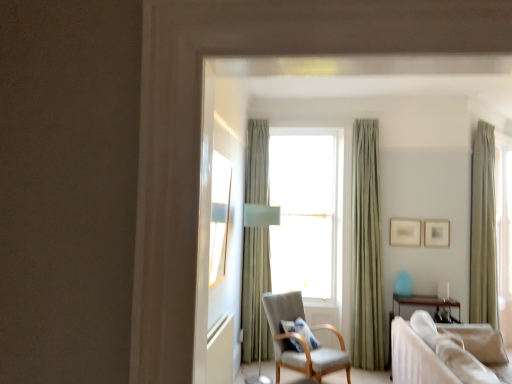
Question: Is sage green fabric curtain at center, the second curtain from the right, positioned far away from green velvet curtain at right, which is the 1th curtain in right-to-left order?

Choices:
 (A) no
 (B) yes

Answer: (B)

Question: From the image's perspective, does sage green fabric curtain at center, the second curtain from the right, appear higher than green velvet curtain at right, which is the 1th curtain in right-to-left order?

Choices:
 (A) no
 (B) yes

Answer: (A)

Question: Can you confirm if sage green fabric curtain at center, acting as the 2th curtain starting from the left, is positioned to the left of green velvet curtain at right, which is counted as the 3th curtain, starting from the left?

Choices:
 (A) yes
 (B) no

Answer: (A)

Question: Can you confirm if sage green fabric curtain at center, acting as the 2th curtain starting from the left, is taller than green velvet curtain at right, which is counted as the 3th curtain, starting from the left?

Choices:
 (A) no
 (B) yes

Answer: (B)

Question: Does sage green fabric curtain at center, acting as the 2th curtain starting from the left, turn towards green velvet curtain at right, which is counted as the 3th curtain, starting from the left?

Choices:
 (A) yes
 (B) no

Answer: (B)

Question: Does point (337, 196) appear closer or farther from the camera than point (507, 365)?

Choices:
 (A) farther
 (B) closer

Answer: (A)

Question: Based on their sizes in the image, would you say white fabric window at center is bigger or smaller than beige fabric couch at lower right?

Choices:
 (A) small
 (B) big

Answer: (A)

Question: Considering the positions of white fabric window at center and beige fabric couch at lower right in the image, is white fabric window at center taller or shorter than beige fabric couch at lower right?

Choices:
 (A) tall
 (B) short

Answer: (A)

Question: Looking at their shapes, would you say white fabric window at center is wider or thinner than beige fabric couch at lower right?

Choices:
 (A) thin
 (B) wide

Answer: (A)

Question: Do you think green fabric curtain at center, which ranks as the 3th curtain in right-to-left order, is within matte gold picture frame at center right, placed as the 2th picture frame when sorted from right to left, or outside of it?

Choices:
 (A) inside
 (B) outside

Answer: (B)

Question: From their relative heights in the image, would you say green fabric curtain at center, the first curtain positioned from the left, is taller or shorter than matte gold picture frame at center right, placed as the 2th picture frame when sorted from right to left?

Choices:
 (A) short
 (B) tall

Answer: (B)

Question: Would you say green fabric curtain at center, which ranks as the 3th curtain in right-to-left order, is to the left or to the right of matte gold picture frame at center right, placed as the 2th picture frame when sorted from right to left, in the picture?

Choices:
 (A) left
 (B) right

Answer: (A)

Question: Is green fabric curtain at center, which ranks as the 3th curtain in right-to-left order, bigger or smaller than matte gold picture frame at center right, placed as the 2th picture frame when sorted from right to left?

Choices:
 (A) small
 (B) big

Answer: (B)

Question: From the image's perspective, is teal glass vase at center-right located above or below beige fabric couch at lower right?

Choices:
 (A) above
 (B) below

Answer: (A)

Question: Is teal glass vase at center-right bigger or smaller than beige fabric couch at lower right?

Choices:
 (A) small
 (B) big

Answer: (A)